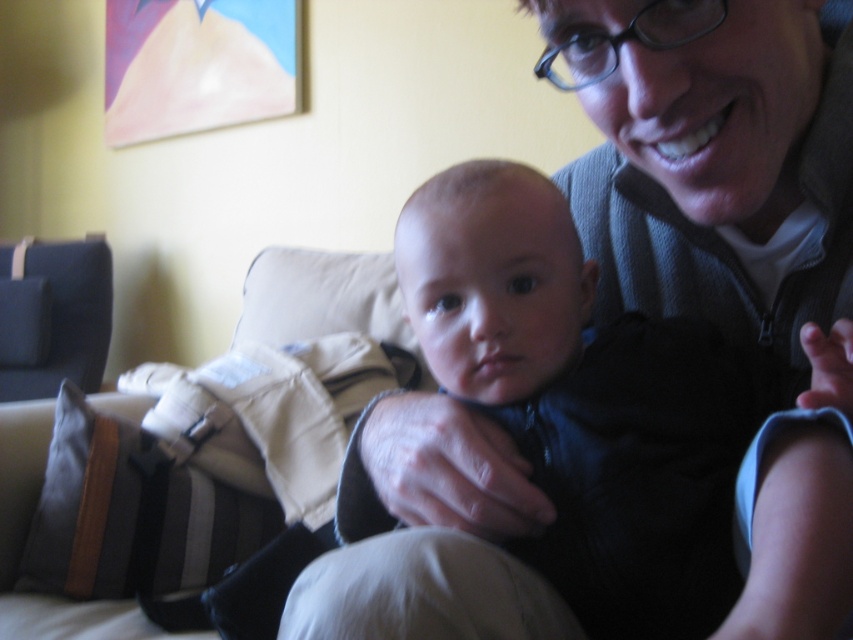
Question: Among these points, which one is nearest to the camera?

Choices:
 (A) click(77, 243)
 (B) click(809, 467)

Answer: (B)

Question: Is dark blue fabric baby at center closer to camera compared to dark blue fabric armchair at left?

Choices:
 (A) yes
 (B) no

Answer: (A)

Question: Does dark blue fabric baby at center lie behind dark blue fabric armchair at left?

Choices:
 (A) no
 (B) yes

Answer: (A)

Question: Observing the image, what is the correct spatial positioning of dark blue fabric baby at center in reference to dark blue fabric armchair at left?

Choices:
 (A) below
 (B) above

Answer: (A)